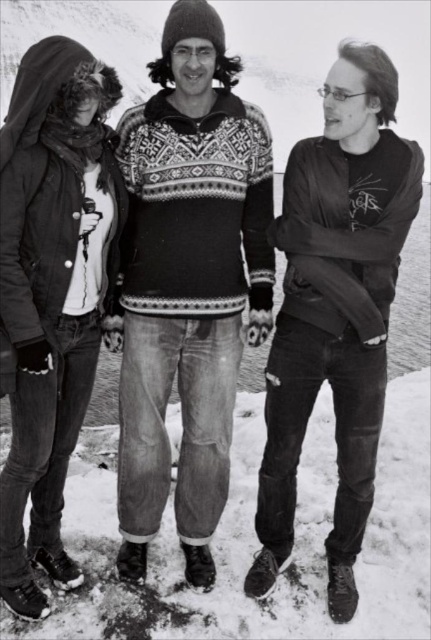
You are a photographer trying to focus on two points in the image. The first point is at coordinates point (315, 342) and the second is at point (84, 292). Which point should you focus on first if you want to start with the one closer to the camera?

Point (315, 342) is closer to the camera than point (84, 292), so you should focus on point (315, 342) first.

You are a photographer setting up a tripod between the matte black jacket at center and the brushed metal jacket at left. Which jacket should you position the tripod closer to if you want to capture both in the frame without zooming in?

You should position the tripod closer to the brushed metal jacket at left because the matte black jacket at center is wider, so placing the tripod nearer to the narrower brushed metal jacket at left will help include both in the frame without needing to zoom.

You are organizing a winter clothing sale and need to display the denim jacket at left and the brushed metal jacket at left on a mannequin. Given that the mannequin has a standard torso width of 40 cm, which jacket would you choose to ensure it fits properly?

The denim jacket at left has a larger width than the brushed metal jacket at left. Since the mannequin has a standard torso width of 40 cm, the brushed metal jacket at left would fit better as it is narrower and less likely to bunch up on the mannequin.